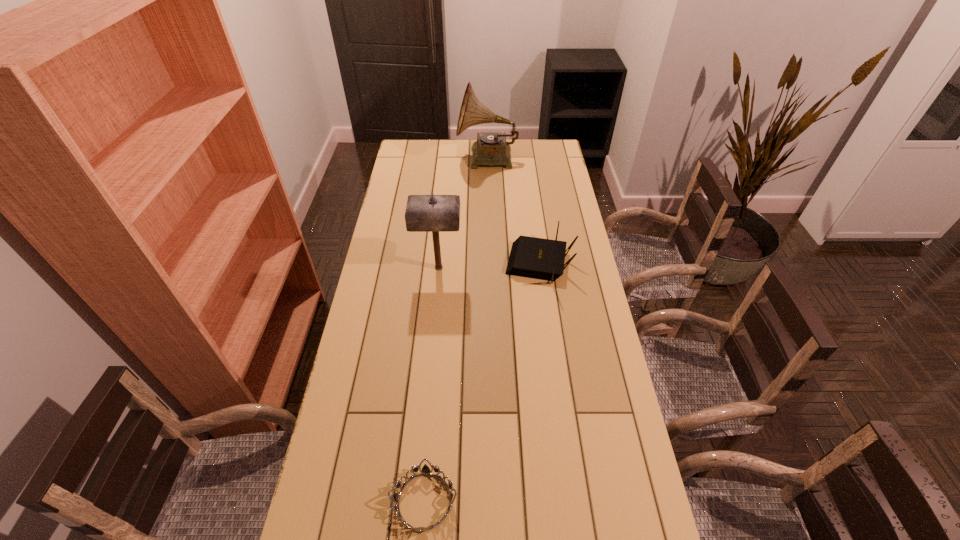
This screenshot has width=960, height=540. Identify the location of free space located on the front-facing side of the nearest object. (615, 501).

I want to click on object that is at the far edge, so click(491, 148).

Find the location of a particular element. This screenshot has height=540, width=960. object that is at the left edge is located at coordinates (432, 213).

You are a GUI agent. You are given a task and a screenshot of the screen. Output one action in this format:
    pyautogui.click(x=<x>, y=<y>)
    Task: Click on the object that is at the right edge
    
    Given the screenshot: What is the action you would take?
    pyautogui.click(x=530, y=257)

You are a GUI agent. You are given a task and a screenshot of the screen. Output one action in this format:
    pyautogui.click(x=<x>, y=<y>)
    Task: Click on the free space at the far edge of the desktop
    This screenshot has width=960, height=540.
    Given the screenshot: What is the action you would take?
    pyautogui.click(x=435, y=154)

You are a GUI agent. You are given a task and a screenshot of the screen. Output one action in this format:
    pyautogui.click(x=<x>, y=<y>)
    Task: Click on the vacant space at the left edge of the desktop
    The width and height of the screenshot is (960, 540).
    Given the screenshot: What is the action you would take?
    pyautogui.click(x=376, y=276)

The width and height of the screenshot is (960, 540). I want to click on free space at the right edge of the desktop, so click(x=569, y=204).

At what (x,y) coordinates should I click in order to perform the action: click on free space at the far left corner. Please return your answer as a coordinate pair (x, y). The height and width of the screenshot is (540, 960). Looking at the image, I should click on (426, 163).

In the image, there is a desktop. What are the coordinates of `free space at the far right corner` in the screenshot? It's located at (560, 156).

Find the location of `free spot between the nearest object and the mallet`. free spot between the nearest object and the mallet is located at coordinates (431, 384).